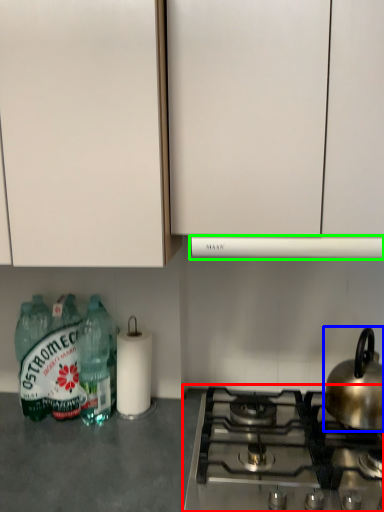
Question: Based on their relative distances, which object is nearer to gas stove (highlighted by a red box)? Choose from kitchen appliance (highlighted by a blue box) and vent (highlighted by a green box).

Choices:
 (A) kitchen appliance
 (B) vent

Answer: (A)